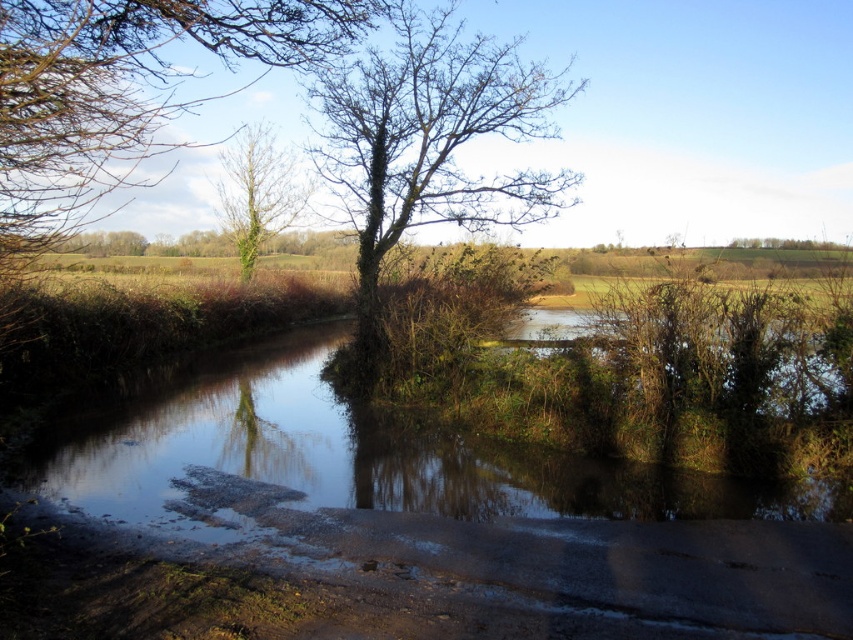
You are a hiker who wants to cross the waterway shown in the scene. There is a point marked at coordinates (439,496) which indicates clear water at center. Based on this information, would you consider this point safe for crossing the waterway?

The point marked at coordinates (439,496) indicates clear water at center, which suggests that the water is not too deep or murky there. This could be a safer spot for crossing compared to areas with unclear water. However, caution is still advised as the actual depth and stability of the ground beneath might not be visible.